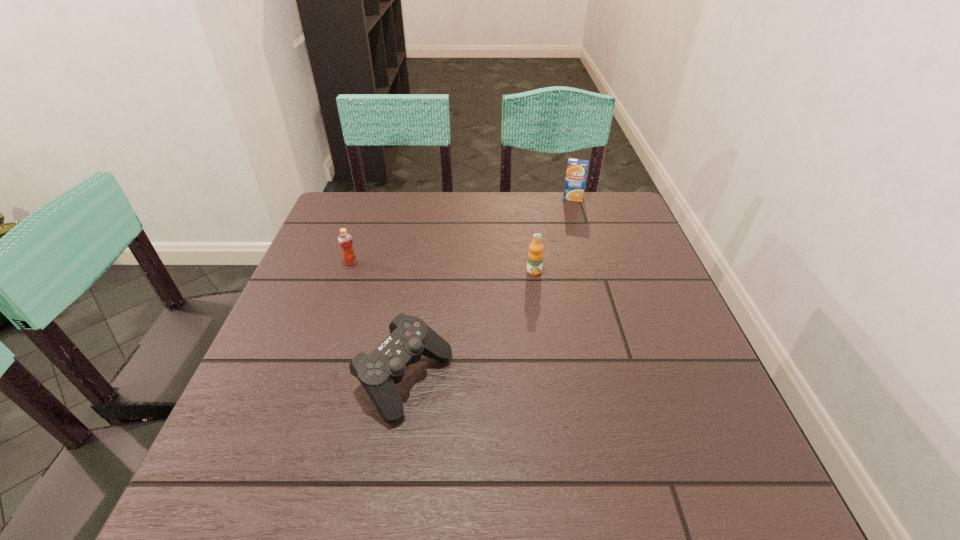
This screenshot has height=540, width=960. Identify the location of free space between the rightmost object and the leftmost orange juice. (462, 230).

Where is `empty space that is in between the leftmost object and the second nearest object`? This screenshot has height=540, width=960. empty space that is in between the leftmost object and the second nearest object is located at coordinates (443, 267).

Where is `free spot between the second farthest object and the second object from left to right`? free spot between the second farthest object and the second object from left to right is located at coordinates (377, 322).

This screenshot has height=540, width=960. I want to click on object that is the closest one to the second nearest orange juice, so click(x=410, y=337).

Locate which object is the closest to the farthest object. Please provide its 2D coordinates. Your answer should be formatted as a tuple, i.e. [(x, y)], where the tuple contains the x and y coordinates of a point satisfying the conditions above.

[(535, 255)]

At what (x,y) coordinates should I click in order to perform the action: click on the second closest orange juice to the farthest orange juice. Please return your answer as a coordinate pair (x, y). This screenshot has height=540, width=960. Looking at the image, I should click on (345, 240).

Find the location of `the closest orange juice to the second orange juice from left to right`. the closest orange juice to the second orange juice from left to right is located at coordinates (577, 169).

Locate an element on the screen. blank space that satisfies the following two spatial constraints: 1. on the back side of the rightmost orange juice; 2. on the left side of the third nearest object is located at coordinates (373, 198).